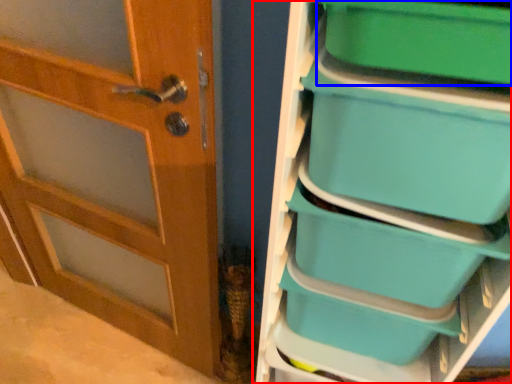
Question: Which point is closer to the camera, shelf (highlighted by a red box) or storage box (highlighted by a blue box)?

Choices:
 (A) shelf
 (B) storage box

Answer: (A)